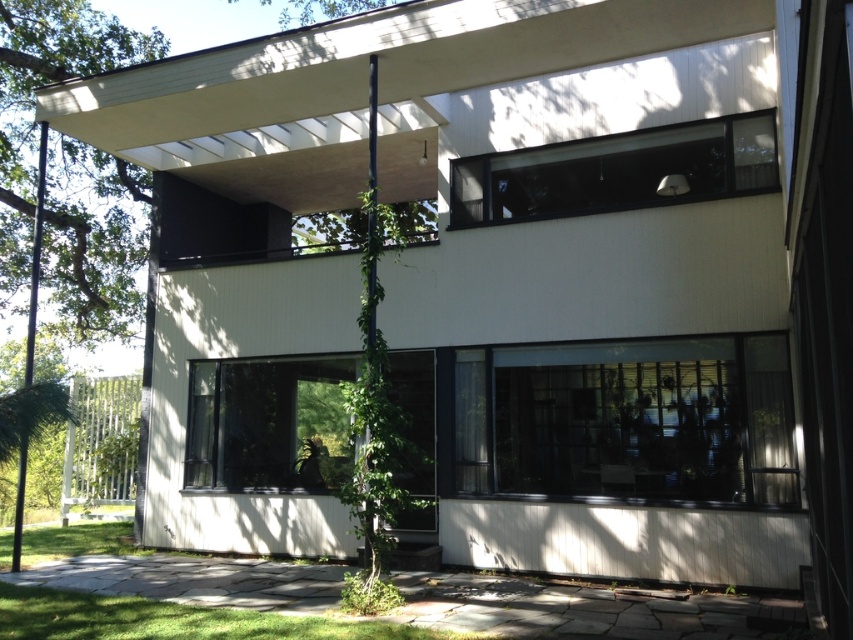
Which is above, green leafy tree at left or green leafy tree at upper center?

Positioned higher is green leafy tree at upper center.

Looking at this image, can you confirm if green leafy tree at left is positioned above green leafy tree at upper center?

Actually, green leafy tree at left is below green leafy tree at upper center.

Which is in front, point (0, 141) or point (325, 13)?

Point (0, 141)

Where is `green leafy tree at left`? This screenshot has width=853, height=640. green leafy tree at left is located at coordinates (93, 241).